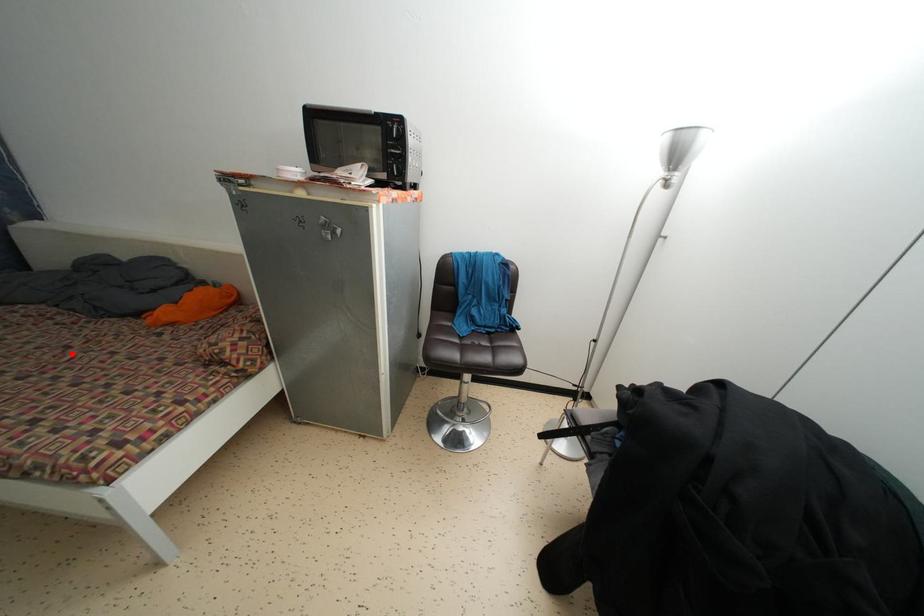
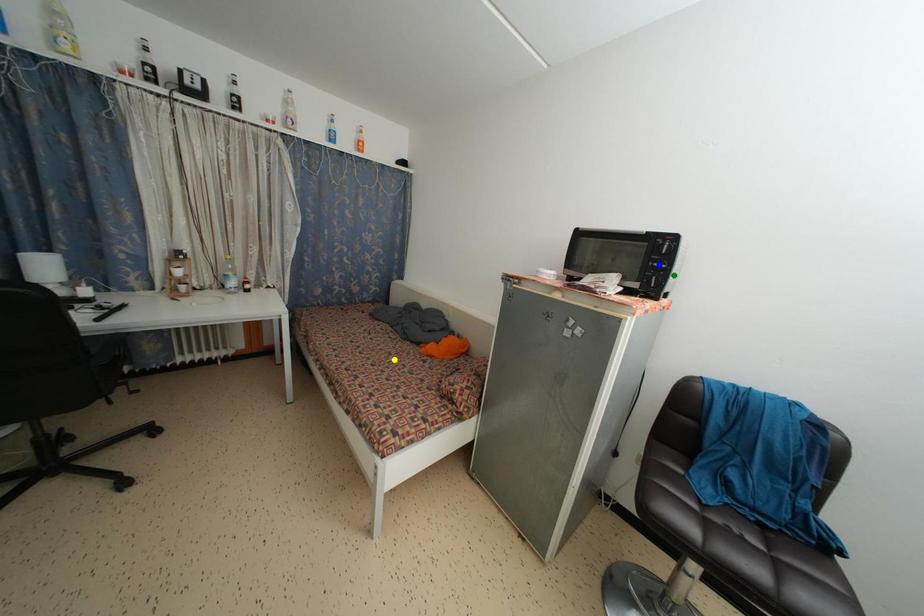
Question: I am providing you with two images of the same scene from different viewpoints. A red point is marked on the first image. You are given multiple points on the second image. Which spot in image 2 lines up with the point in image 1?

Choices:
 (A) blue point
 (B) green point
 (C) yellow point

Answer: (C)